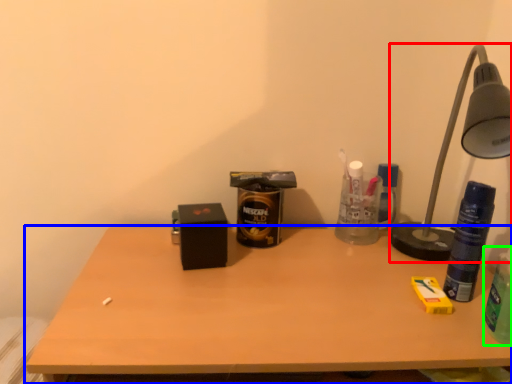
Question: Which object is the farthest from lamp (highlighted by a red box)? Choose among these: desk (highlighted by a blue box) or beverage (highlighted by a green box).

Choices:
 (A) desk
 (B) beverage

Answer: (A)